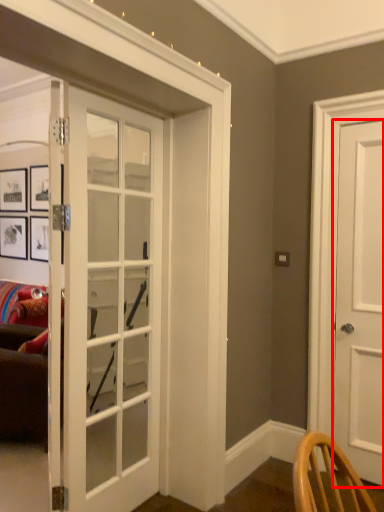
Question: From the image's perspective, what is the correct spatial relationship of door (annotated by the red box) in relation to door?

Choices:
 (A) above
 (B) below

Answer: (A)